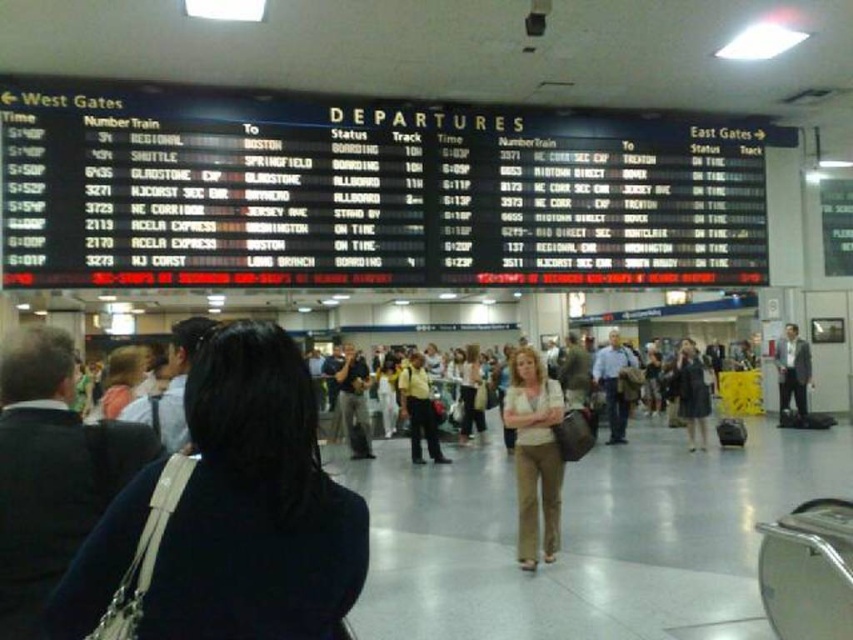
Locate an element on the screen. This screenshot has width=853, height=640. beige fabric pants at center is located at coordinates pos(534,452).

Does beige fabric pants at center lie behind yellow fabric shirt at center?

No, it is in front of yellow fabric shirt at center.

Between point (531, 444) and point (434, 458), which one is positioned in front?

Point (531, 444) is more forward.

Identify the location of beige fabric pants at center. The image size is (853, 640). (534, 452).

Is point (416, 376) farther from camera compared to point (694, 372)?

That is False.

Is yellow fabric shirt at center positioned at the back of dark gray fabric dress at right?

No, it is in front of dark gray fabric dress at right.

Which is in front, point (433, 420) or point (686, 419)?

Point (433, 420) is in front.

At what (x,y) coordinates should I click in order to perform the action: click on yellow fabric shirt at center. Please return your answer as a coordinate pair (x, y). This screenshot has width=853, height=640. Looking at the image, I should click on (419, 410).

How much distance is there between dark gray shirt at center and light beige pants at center?

The distance of dark gray shirt at center from light beige pants at center is 2.33 meters.

Between dark gray shirt at center and light beige pants at center, which one appears on the right side from the viewer's perspective?

Positioned to the right is light beige pants at center.

Locate an element on the screen. dark gray shirt at center is located at coordinates (x=352, y=401).